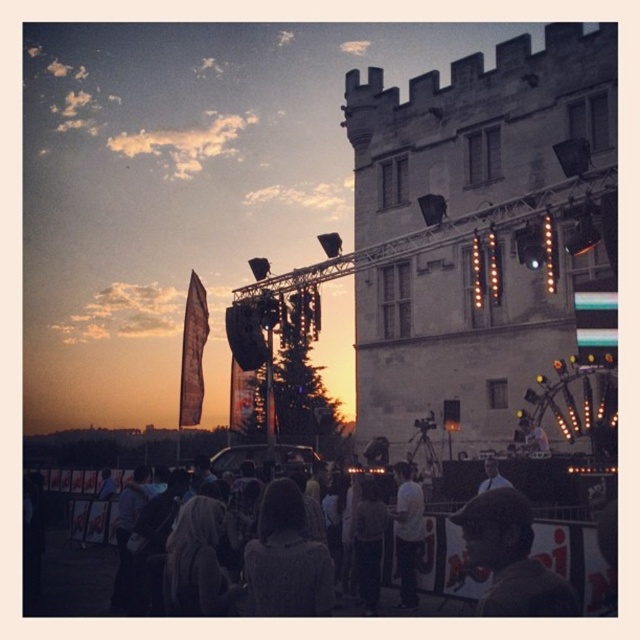
Between point (404, 525) and point (484, 461), which one is positioned in front?

Point (404, 525) is in front.

How much distance is there between white cotton shirt at center and light brown hair at center?

white cotton shirt at center and light brown hair at center are 10.24 meters apart.

Does point (410, 545) come farther from viewer compared to point (499, 480)?

That is False.

In order to click on white cotton shirt at center in this screenshot , I will do `click(406, 531)`.

Is dark brown leather jacket at lower right below knitted gray sweater at center?

No.

This screenshot has width=640, height=640. I want to click on dark brown leather jacket at lower right, so tap(509, 557).

Which is above, dark brown leather jacket at lower right or light brown hair at center?

light brown hair at center

Based on the photo, between dark brown leather jacket at lower right and light brown hair at center, which one appears on the right side from the viewer's perspective?

From the viewer's perspective, light brown hair at center appears more on the right side.

Where is `dark brown leather jacket at lower right`? This screenshot has height=640, width=640. dark brown leather jacket at lower right is located at coordinates (509, 557).

You are a GUI agent. You are given a task and a screenshot of the screen. Output one action in this format:
    pyautogui.click(x=<x>, y=<y>)
    Task: Click on the dark brown leather jacket at lower right
    
    Given the screenshot: What is the action you would take?
    pyautogui.click(x=509, y=557)